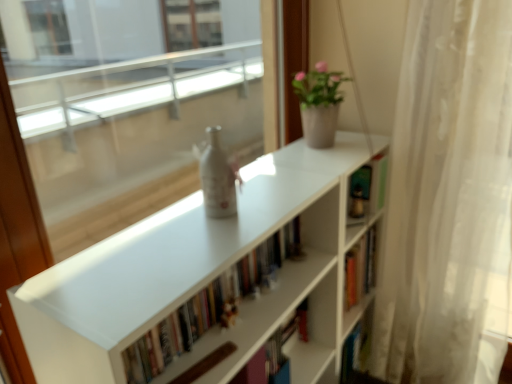
The height and width of the screenshot is (384, 512). I want to click on free space above white matte bookcase at center (from a real-world perspective), so click(x=238, y=202).